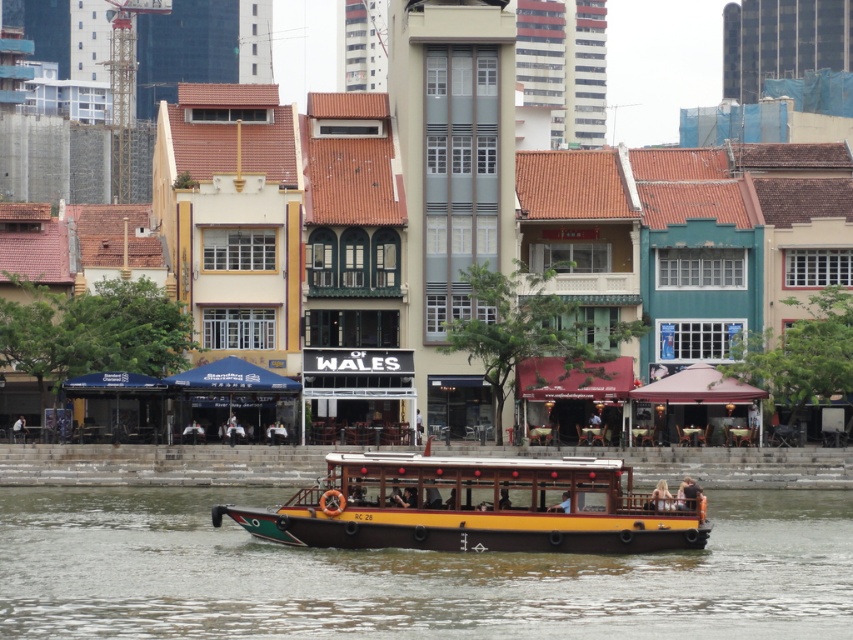
You are standing on the riverbank and want to locate the yellow wood boat at center. According to the coordinates provided, where should you look relative to your position?

You should look towards the center of the image, as the yellow wood boat at center is located at point (407, 576), which corresponds to the central area of the scene.

You are taking a photo of the riverside scene. You want to focus on both point (35, 554) and point (474, 468). Which point should you focus on first to ensure both are in sharp focus?

You should focus on point (35, 554) first because it is closer to the camera than point (474, 468). This way, the depth of field will naturally cover both points when focusing on the closer one.

You are a tourist on the river and see the yellow wood boat at center and the wooden polished boat at center. Which boat is closer to the left side of your view?

The yellow wood boat at center is closer to the left side of your view because it is positioned to the left of the wooden polished boat at center.